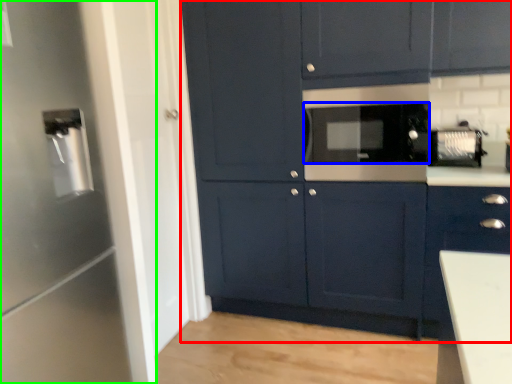
Question: Which is nearer to the cabinetry (highlighted by a red box)? appliance (highlighted by a blue box) or appliance (highlighted by a green box).

Choices:
 (A) appliance
 (B) appliance

Answer: (A)